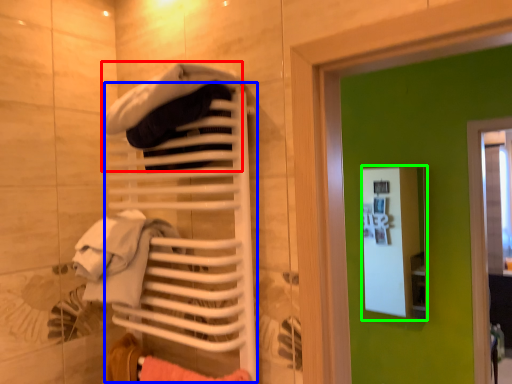
Question: Considering the real-world distances, which object is closest to clothing (highlighted by a red box)? closet (highlighted by a blue box) or medicine cabinet (highlighted by a green box).

Choices:
 (A) closet
 (B) medicine cabinet

Answer: (A)